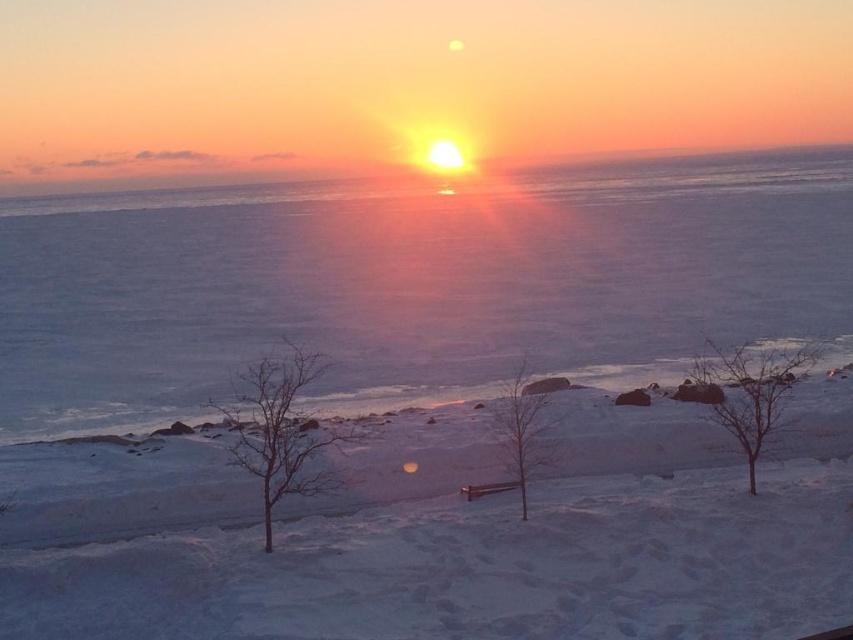
You are standing at the wooden bench in the middle ground of the winter sunset scene. You see the bare tree at lower right and the bare wood tree at center. Which tree is farther away from you?

The bare tree at lower right is 5.30 meters away from the bare wood tree at center, so the bare tree at lower right is farther away from you.

You are standing in the winter sunset scene and notice two trees. Which tree, the bare tree at lower right or the bare wood tree at center, is positioned higher in the image?

The bare tree at lower right is positioned higher in the image than the bare wood tree at center.